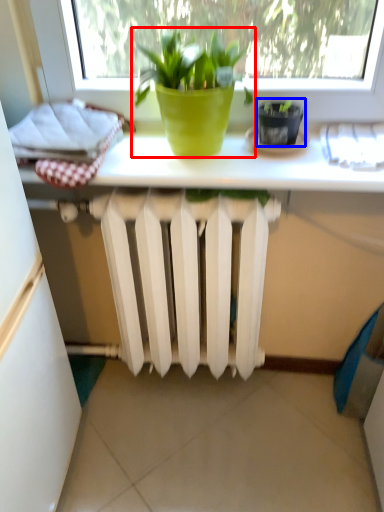
Question: Which point is closer to the camera, houseplant (highlighted by a red box) or flowerpot (highlighted by a blue box)?

Choices:
 (A) houseplant
 (B) flowerpot

Answer: (A)